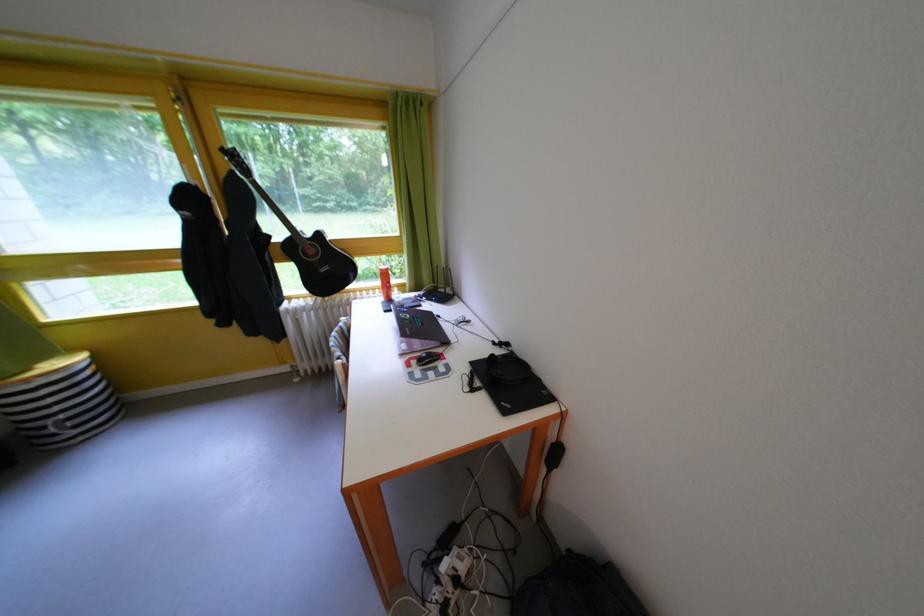
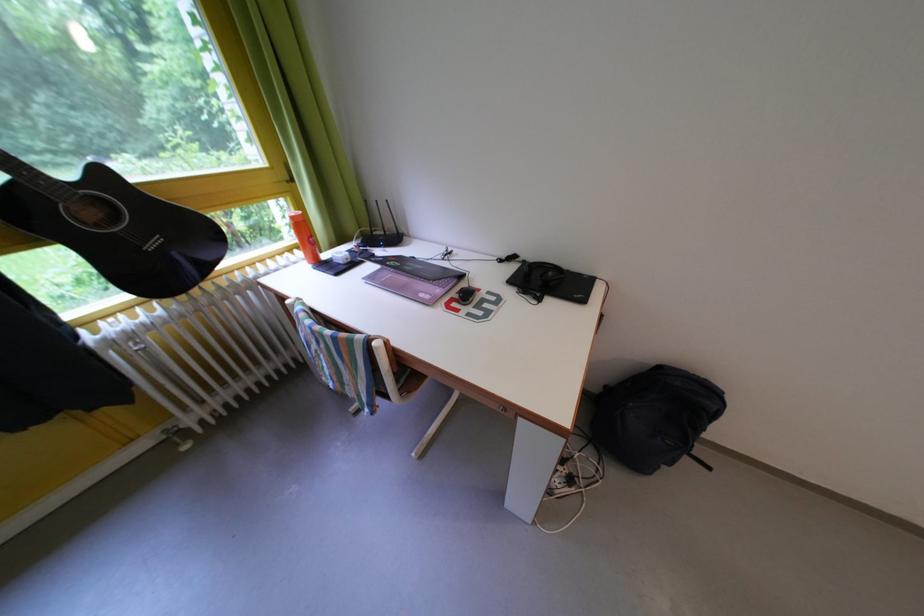
The images are taken continuously from a first-person perspective. In which direction is your viewpoint rotating?

The rotation direction of the camera is right-down.